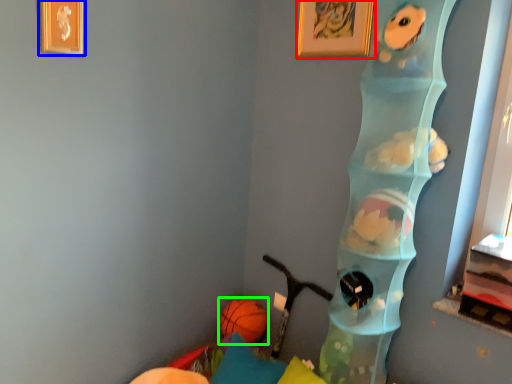
Question: Which object is positioned farthest from picture frame (highlighted by a red box)? Select from picture frame (highlighted by a blue box) and ball (highlighted by a green box).

Choices:
 (A) picture frame
 (B) ball

Answer: (B)